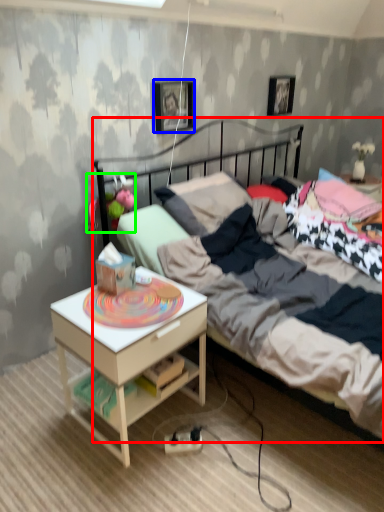
Question: Estimate the real-world distances between objects in this image. Which object is farther from bed (highlighted by a red box), picture frame (highlighted by a blue box) or toy (highlighted by a green box)?

Choices:
 (A) picture frame
 (B) toy

Answer: (A)